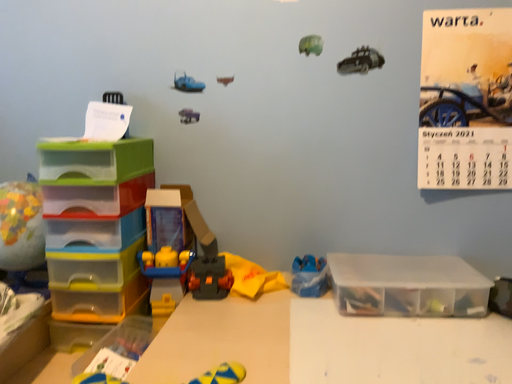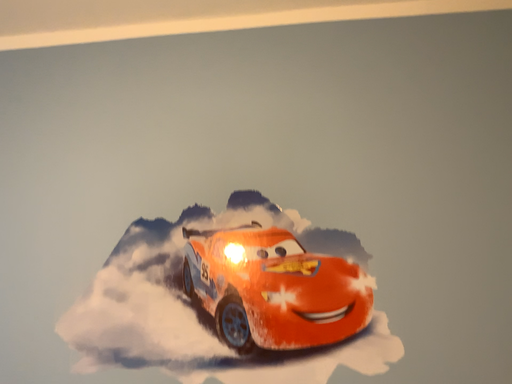
Question: Which way did the camera rotate in the video?

Choices:
 (A) rotated upward
 (B) rotated downward

Answer: (A)